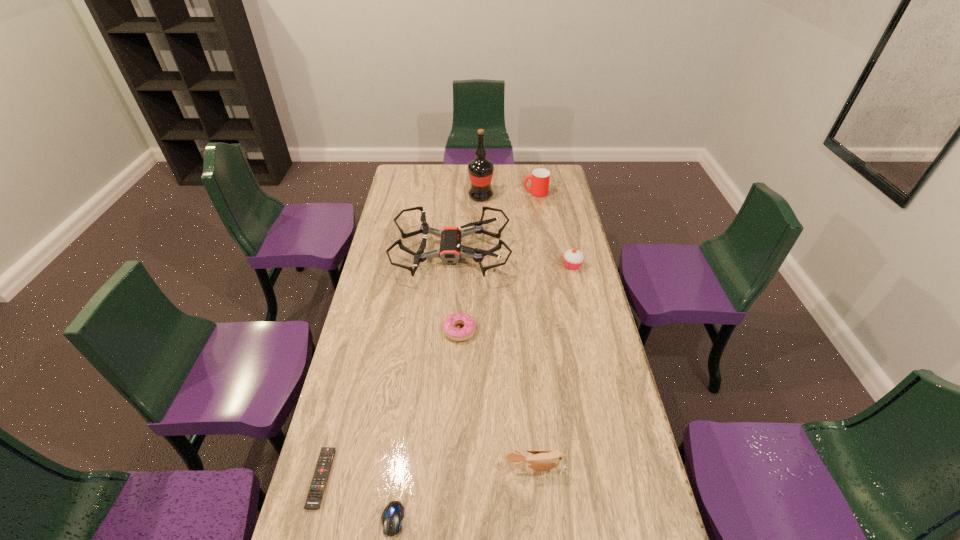
In order to click on drone present at the left edge in this screenshot , I will do `click(450, 251)`.

The height and width of the screenshot is (540, 960). What are the coordinates of `remote control that is at the left edge` in the screenshot? It's located at (317, 487).

Find the location of a particular element. The width and height of the screenshot is (960, 540). cup at the right edge is located at coordinates (540, 178).

Find the location of a particular element. cupcake that is at the right edge is located at coordinates (573, 258).

At what (x,y) coordinates should I click in order to perform the action: click on object that is at the far right corner. Please return your answer as a coordinate pair (x, y). Image resolution: width=960 pixels, height=540 pixels. Looking at the image, I should click on (540, 178).

Where is `blank space at the left edge of the desktop`? Image resolution: width=960 pixels, height=540 pixels. blank space at the left edge of the desktop is located at coordinates (393, 271).

The image size is (960, 540). In order to click on vacant space at the right edge of the desktop in this screenshot , I will do `click(580, 242)`.

In the image, there is a desktop. At what (x,y) coordinates should I click in order to perform the action: click on vacant space at the far left corner. Please return your answer as a coordinate pair (x, y). The height and width of the screenshot is (540, 960). Looking at the image, I should click on (402, 168).

Identify the location of free space that is in between the shortest object and the computer mouse. This screenshot has width=960, height=540. (357, 498).

Find the location of `free area in between the drone and the seventh tallest object`. free area in between the drone and the seventh tallest object is located at coordinates (422, 386).